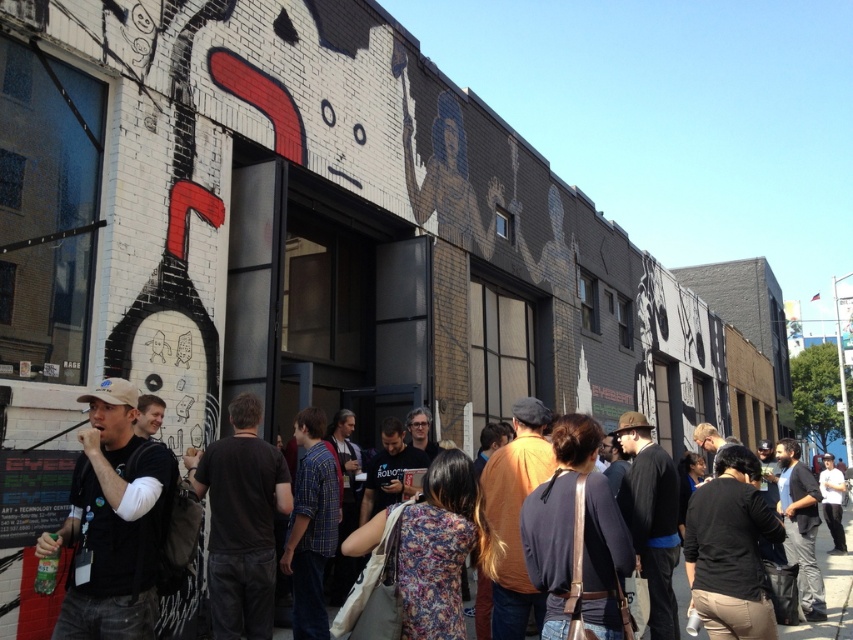
Question: Does black matte t-shirt at lower left come in front of dark clothing crowd at center?

Choices:
 (A) no
 (B) yes

Answer: (B)

Question: Among these objects, which one is nearest to the camera?

Choices:
 (A) black matte t-shirt at lower left
 (B) dark clothing crowd at center

Answer: (A)

Question: Which object is closer to the camera taking this photo?

Choices:
 (A) dark clothing crowd at center
 (B) black matte t-shirt at lower left

Answer: (B)

Question: Is black matte t-shirt at lower left below dark clothing crowd at center?

Choices:
 (A) no
 (B) yes

Answer: (A)

Question: Is black matte t-shirt at lower left below dark clothing crowd at center?

Choices:
 (A) yes
 (B) no

Answer: (B)

Question: Which object is farther from the camera taking this photo?

Choices:
 (A) black matte t-shirt at lower left
 (B) dark clothing crowd at center

Answer: (B)